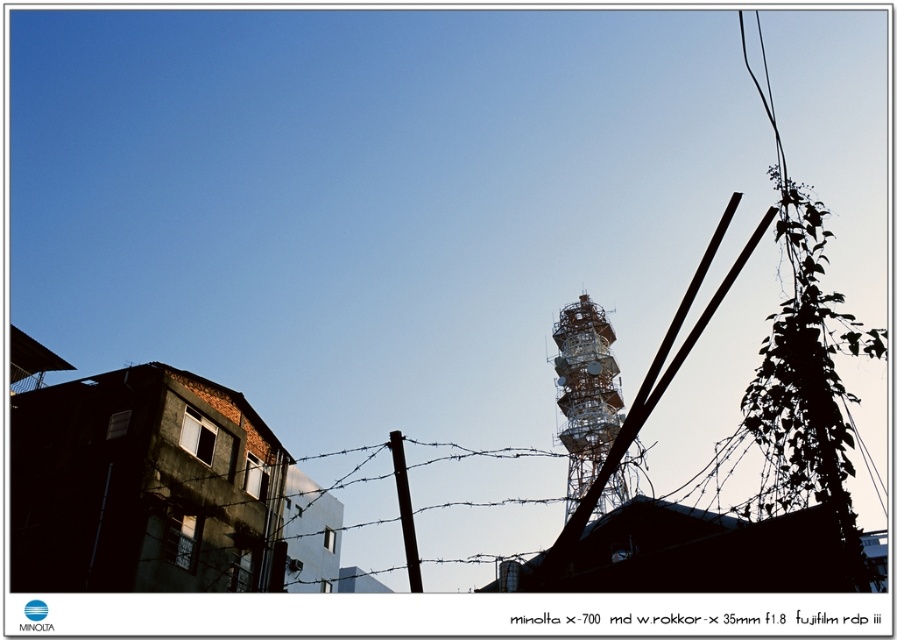
You are a city planner assessing the urban skyline. You notice the metallic lattice tower at center and the black matte telegraph pole at center. Which structure would cast a longer shadow during midday when the sun is directly overhead?

The metallic lattice tower at center is much taller than the black matte telegraph pole at center, so it would cast a longer shadow during midday when the sun is directly overhead.

You are standing in the urban scene and want to determine which of the two points, point (564, 436) or point (405, 545), is closer to you. Which point is nearer?

Point (564, 436) is further to the viewer than point (405, 545), so the closer point is point (405, 545).